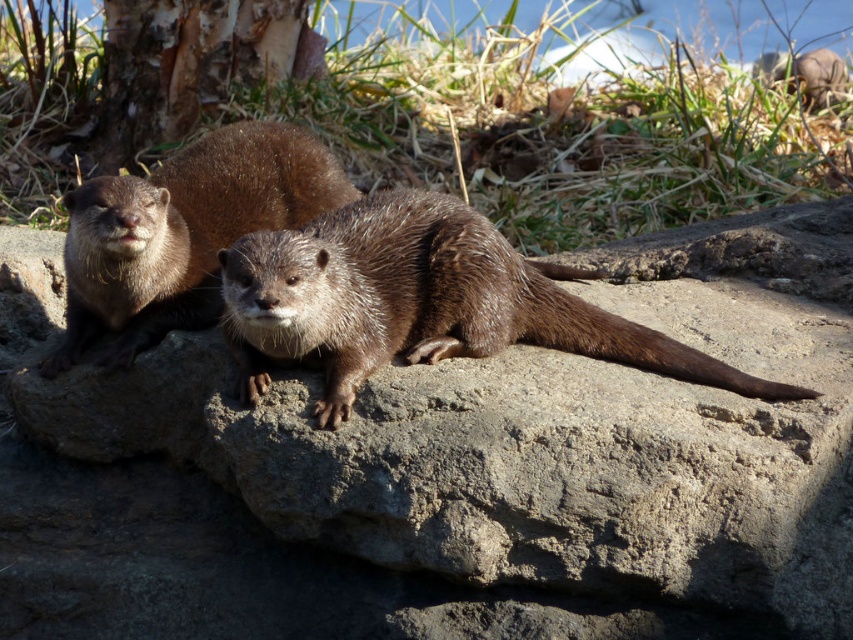
Can you confirm if gray rough rock at center is shorter than brown furry otter at center?

In fact, gray rough rock at center may be taller than brown furry otter at center.

Is gray rough rock at center to the left of brown furry otter at center from the viewer's perspective?

No, gray rough rock at center is not to the left of brown furry otter at center.

Where is `gray rough rock at center`? Image resolution: width=853 pixels, height=640 pixels. gray rough rock at center is located at coordinates (467, 476).

Does gray rough rock at center have a smaller size compared to brown fuzzy otter at left?

No.

Who is positioned more to the left, gray rough rock at center or brown fuzzy otter at left?

From the viewer's perspective, brown fuzzy otter at left appears more on the left side.

Is point (762, 570) positioned before point (178, 218)?

Yes, it is in front of point (178, 218).

Where is `gray rough rock at center`? gray rough rock at center is located at coordinates (467, 476).

Does brown furry otter at center have a larger size compared to brown fuzzy otter at left?

Correct, brown furry otter at center is larger in size than brown fuzzy otter at left.

Where is `brown furry otter at center`? brown furry otter at center is located at coordinates (422, 301).